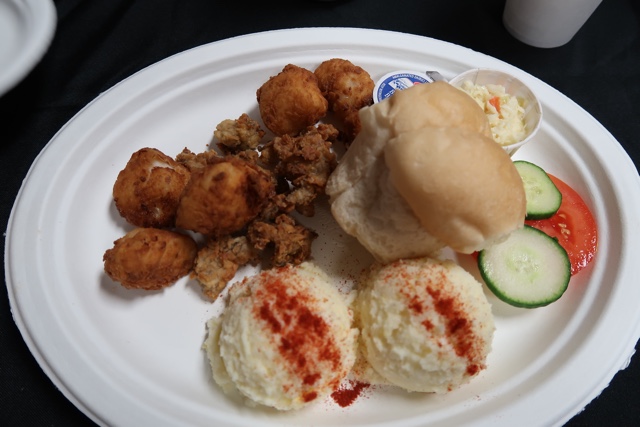
Image resolution: width=640 pixels, height=427 pixels. In order to click on cup in this screenshot , I will do `click(534, 28)`.